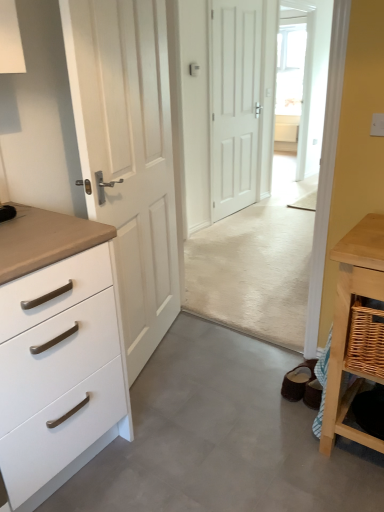
The height and width of the screenshot is (512, 384). In order to click on empty space that is to the right of white matte door at center, the first door positioned from the back in this screenshot , I will do `click(288, 206)`.